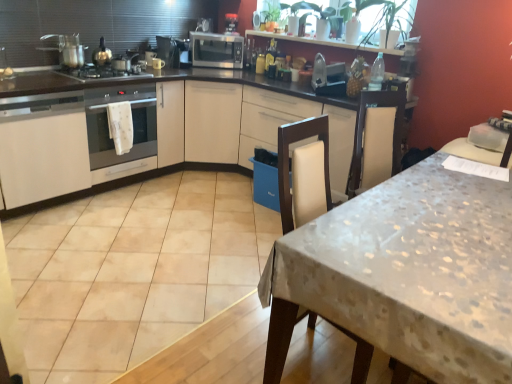
Where is `vacant space in front of black plastic coffee machine at upper center`? vacant space in front of black plastic coffee machine at upper center is located at coordinates coord(226,37).